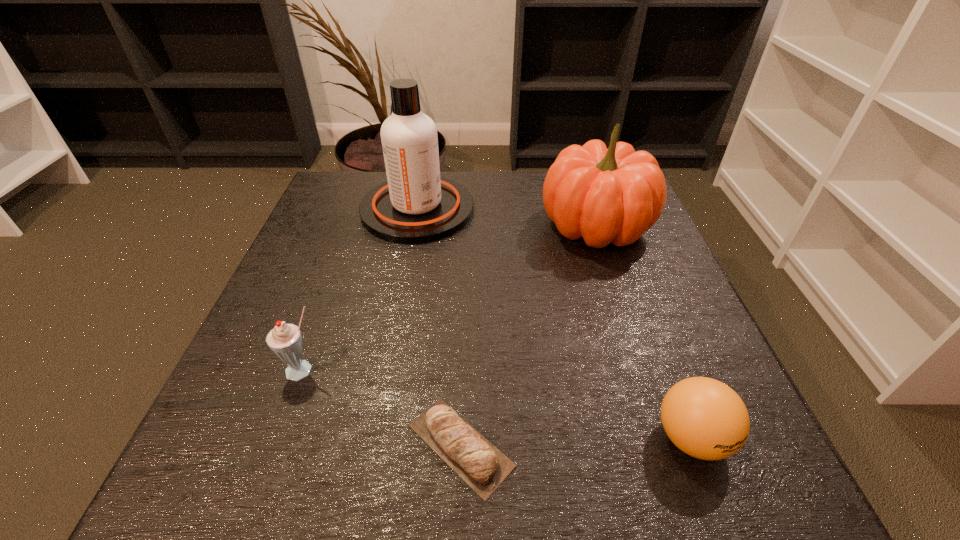
Identify the location of empty space that is in between the second tallest object and the cleansing agent. (506, 218).

Locate an element on the screen. empty space between the fourth tallest object and the third shortest object is located at coordinates (497, 404).

What are the coordinates of `free spot between the third tallest object and the cleansing agent` in the screenshot? It's located at (361, 290).

Image resolution: width=960 pixels, height=540 pixels. Find the location of `vacant area that lies between the pita bread and the cleansing agent`. vacant area that lies between the pita bread and the cleansing agent is located at coordinates (439, 327).

Locate an element on the screen. The width and height of the screenshot is (960, 540). vacant space that is in between the pumpkin and the second shortest object is located at coordinates (643, 332).

Locate an element on the screen. The image size is (960, 540). free spot between the pita bread and the cleansing agent is located at coordinates (439, 327).

I want to click on free space between the cleansing agent and the third tallest object, so click(361, 290).

Where is `the third closest object to the fourth shortest object`? This screenshot has width=960, height=540. the third closest object to the fourth shortest object is located at coordinates (471, 455).

Select which object is the second closest to the third shortest object. Please provide its 2D coordinates. Your answer should be formatted as a tuple, i.e. [(x, y)], where the tuple contains the x and y coordinates of a point satisfying the conditions above.

[(415, 205)]

Locate an element on the screen. The image size is (960, 540). vacant space that satisfies the following two spatial constraints: 1. on the straw side of the shortest object; 2. on the left side of the third farthest object is located at coordinates tap(276, 446).